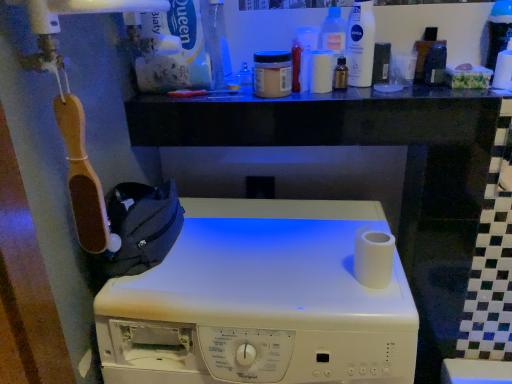
Find the location of a particular element. The image size is (512, 384). free space in front of white plastic bottle at upper center, the 2th cleaning product positioned from the left is located at coordinates (374, 92).